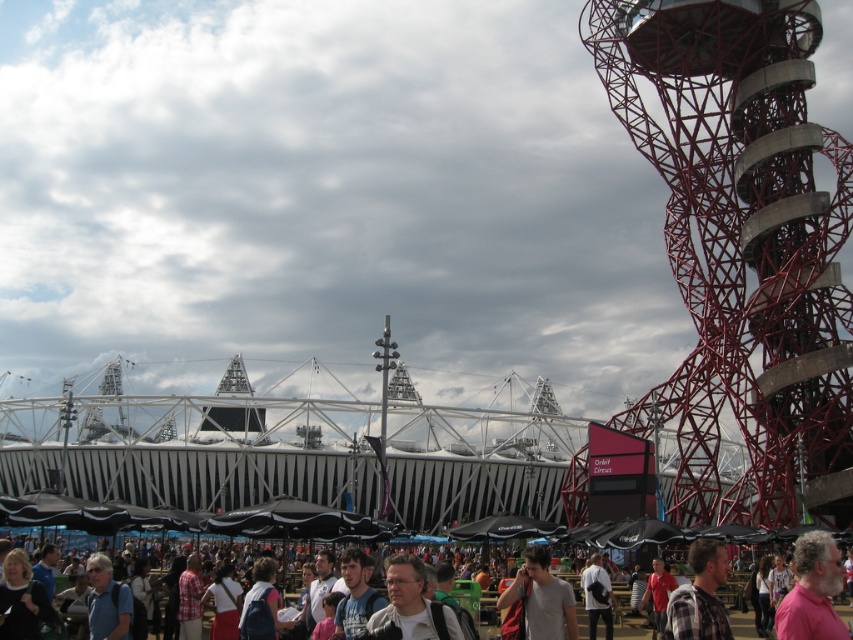
Is red metal structure at right thinner than white shirt at center?

Yes, red metal structure at right is thinner than white shirt at center.

Can you confirm if red metal structure at right is positioned to the right of white shirt at center?

Correct, you'll find red metal structure at right to the right of white shirt at center.

What do you see at coordinates (741, 243) in the screenshot? The image size is (853, 640). I see `red metal structure at right` at bounding box center [741, 243].

The width and height of the screenshot is (853, 640). I want to click on red metal structure at right, so click(741, 243).

Image resolution: width=853 pixels, height=640 pixels. Find the location of `light gray fabric backpack at center`. light gray fabric backpack at center is located at coordinates (409, 605).

Who is taller, light gray fabric backpack at center or plaid fabric shirt at center?

Standing taller between the two is plaid fabric shirt at center.

Image resolution: width=853 pixels, height=640 pixels. Find the location of `light gray fabric backpack at center`. light gray fabric backpack at center is located at coordinates (409, 605).

Can you confirm if plaid fabric shirt at center is positioned to the right of white shirt at center?

Yes, plaid fabric shirt at center is to the right of white shirt at center.

Which is below, plaid fabric shirt at center or white shirt at center?

white shirt at center

Between point (666, 602) and point (486, 598), which one is positioned behind?

The point (486, 598) is behind.

The image size is (853, 640). Find the location of `plaid fabric shirt at center`. plaid fabric shirt at center is located at coordinates (700, 595).